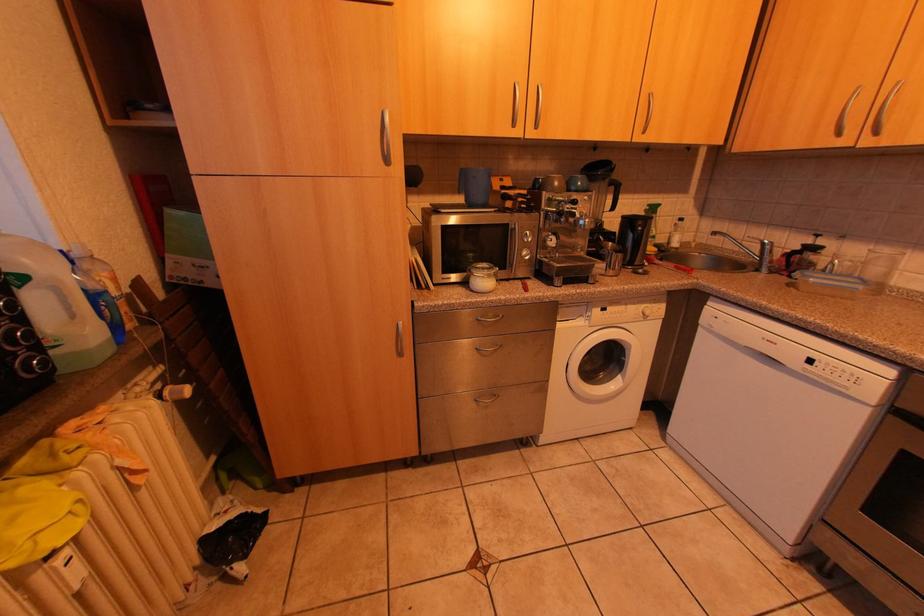
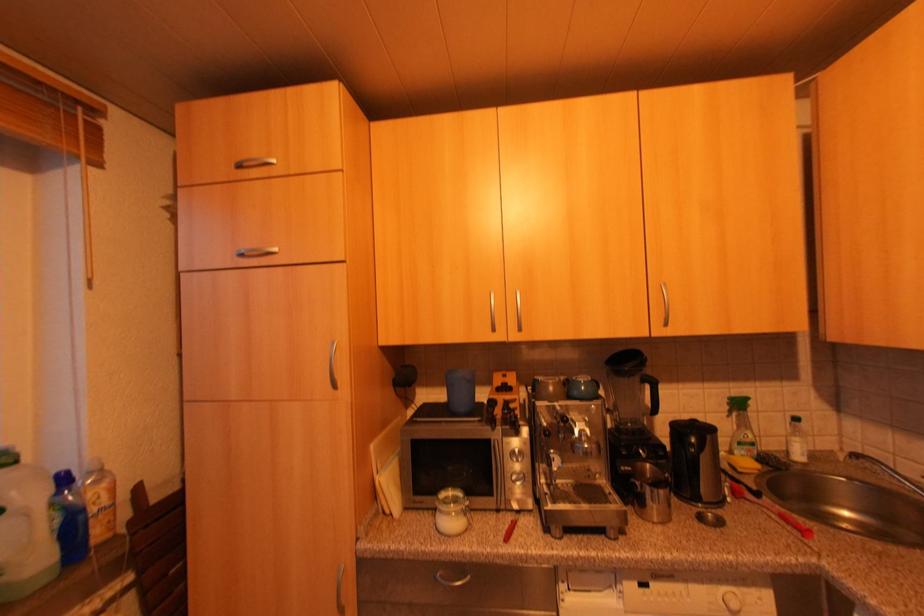
First-person continuous shooting, in which direction is the camera rotating?

The rotation direction of the camera is left-up.